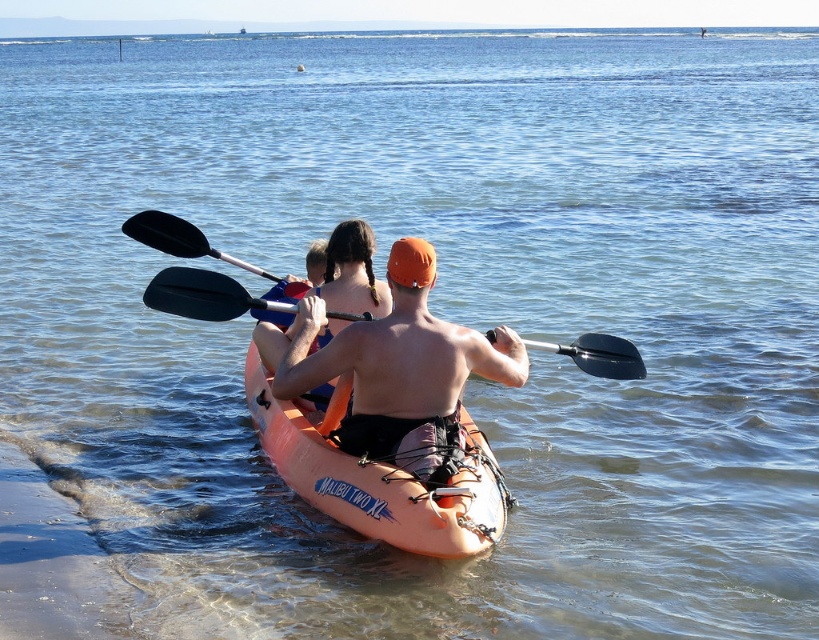
Between orange fabric shirt at center and orange matte kayak at center, which one appears on the left side from the viewer's perspective?

orange matte kayak at center

At what (x,y) coordinates should I click in order to perform the action: click on orange fabric shirt at center. Please return your answer as a coordinate pair (x, y). Looking at the image, I should click on (396, 369).

Is orange matte kayak at center above black rubber paddle at center?

Incorrect, orange matte kayak at center is not positioned above black rubber paddle at center.

Who is higher up, orange matte kayak at center or black rubber paddle at center?

black rubber paddle at center

You are a GUI agent. You are given a task and a screenshot of the screen. Output one action in this format:
    pyautogui.click(x=<x>, y=<y>)
    Task: Click on the orange matte kayak at center
    
    Given the screenshot: What is the action you would take?
    tap(378, 477)

Can you confirm if orange fabric shirt at center is wider than black rubber paddle at center?

Correct, the width of orange fabric shirt at center exceeds that of black rubber paddle at center.

Does orange fabric shirt at center appear under black rubber paddle at center?

Correct, orange fabric shirt at center is located below black rubber paddle at center.

What do you see at coordinates (396, 369) in the screenshot? This screenshot has width=819, height=640. I see `orange fabric shirt at center` at bounding box center [396, 369].

Identify the location of orange fabric shirt at center. Image resolution: width=819 pixels, height=640 pixels. (396, 369).